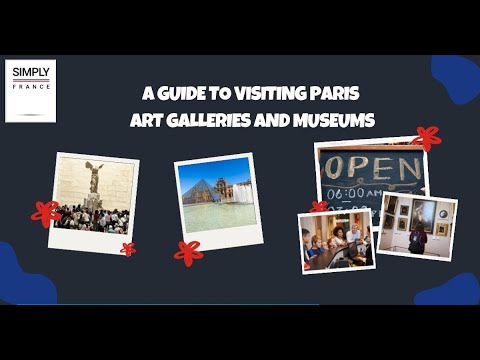
The width and height of the screenshot is (480, 360). I want to click on abstract decor on bulletin board, so click(x=461, y=289), click(x=428, y=301), click(x=36, y=288), click(x=9, y=271), click(x=450, y=75).